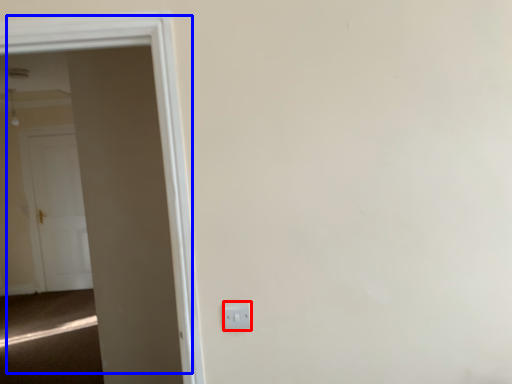
Question: Which point is closer to the camera, electric outlet (highlighted by a red box) or door (highlighted by a blue box)?

Choices:
 (A) electric outlet
 (B) door

Answer: (B)